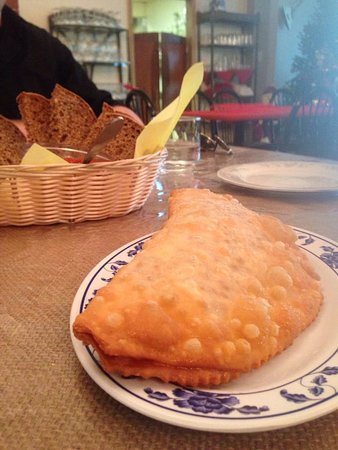
Where is `chair`? The image size is (338, 450). chair is located at coordinates (264, 94), (131, 101), (290, 133).